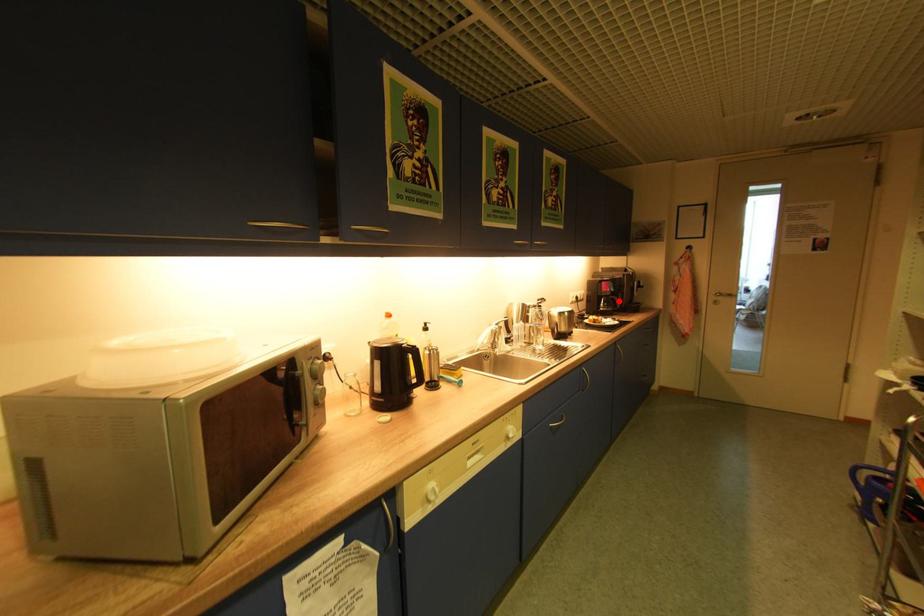
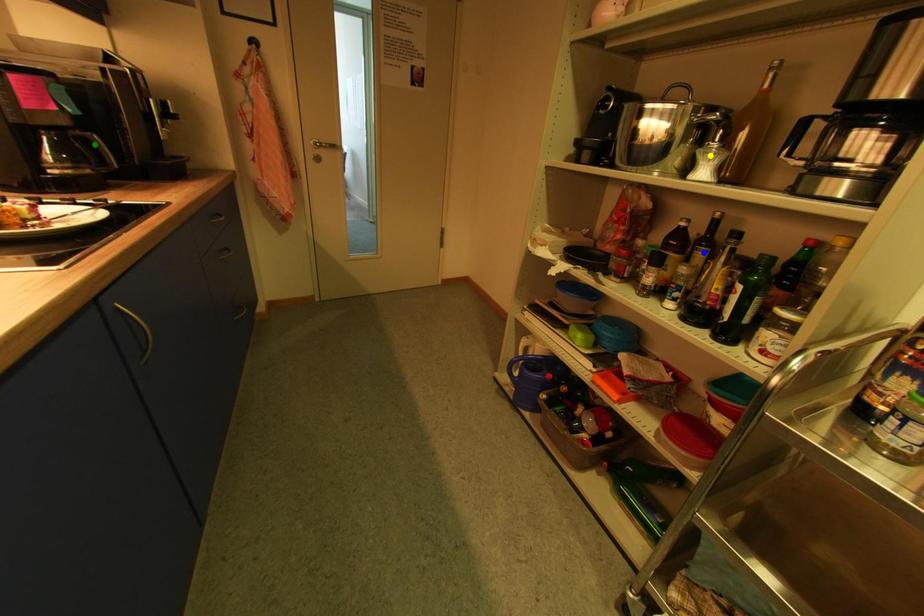
Question: I am providing you with two images of the same scene from different viewpoints. A red point is marked on the first image. You are given multiple points on the second image. Which point in image 2 is actually the same real-world point as the red point in image 1?

Choices:
 (A) blue point
 (B) green point
 (C) yellow point

Answer: (B)